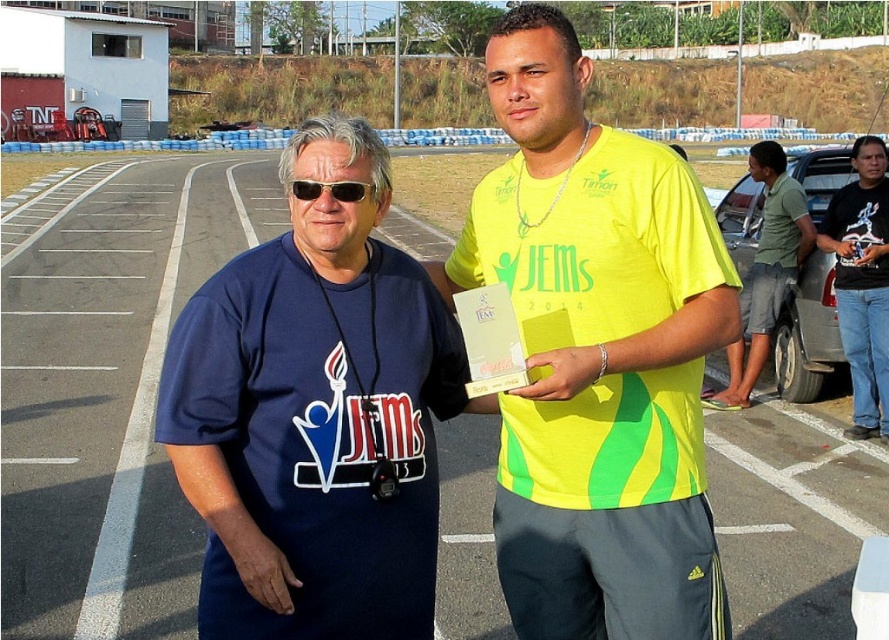
What do you see at coordinates (597, 355) in the screenshot? I see `yellow matte shirt at center` at bounding box center [597, 355].

Is yellow matte shirt at center wider than gray metallic car at right?

No.

Describe the element at coordinates (597, 355) in the screenshot. The width and height of the screenshot is (889, 640). I see `yellow matte shirt at center` at that location.

Locate an element on the screen. The width and height of the screenshot is (889, 640). yellow matte shirt at center is located at coordinates (597, 355).

Measure the distance between point (722, 209) and camera.

8.29 meters

Where is `gray metallic car at right`? gray metallic car at right is located at coordinates (806, 332).

This screenshot has height=640, width=889. I want to click on gray metallic car at right, so click(x=806, y=332).

This screenshot has width=889, height=640. What are the coordinates of `gray metallic car at right` in the screenshot? It's located at (806, 332).

Can you confirm if blue fabric shirt at center is wider than gray metallic car at right?

No, blue fabric shirt at center is not wider than gray metallic car at right.

Is point (292, 284) behind point (758, 196)?

No.

You are a GUI agent. You are given a task and a screenshot of the screen. Output one action in this format:
    pyautogui.click(x=<x>, y=<y>)
    Task: Click on the blue fabric shirt at center
    The height and width of the screenshot is (640, 889).
    Given the screenshot: What is the action you would take?
    pyautogui.click(x=315, y=413)